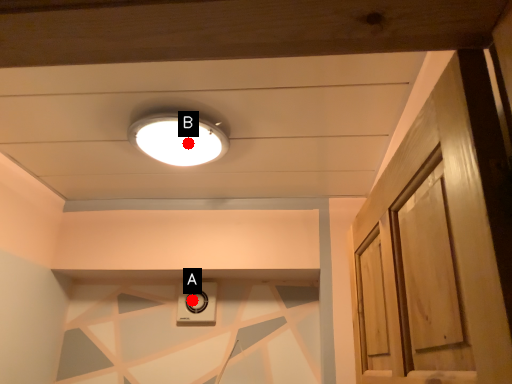
Question: Two points are circled on the image, labeled by A and B beside each circle. Which point appears farthest from the camera in this image?

Choices:
 (A) A is further
 (B) B is further

Answer: (A)